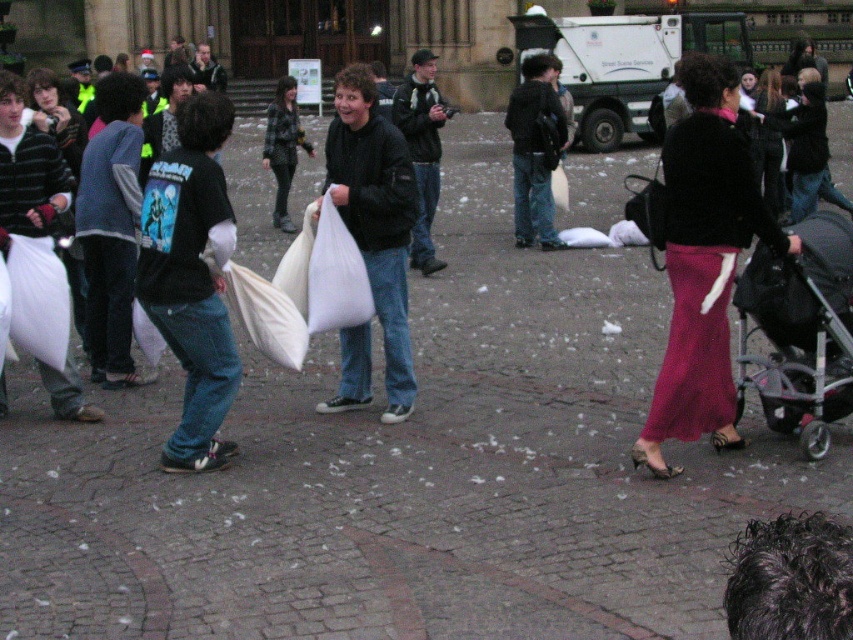
Question: Can you confirm if matte black sweater at center is positioned to the left of black plastic stroller at lower right?

Choices:
 (A) no
 (B) yes

Answer: (B)

Question: Which object is farther from the camera taking this photo?

Choices:
 (A) black plastic stroller at lower right
 (B) matte black sweater at center

Answer: (A)

Question: Is matte black sweater at center wider than black plastic stroller at lower right?

Choices:
 (A) yes
 (B) no

Answer: (A)

Question: Is matte black sweater at center bigger than black plastic stroller at lower right?

Choices:
 (A) yes
 (B) no

Answer: (A)

Question: Which point is farther to the camera?

Choices:
 (A) (791, 378)
 (B) (711, 292)

Answer: (A)